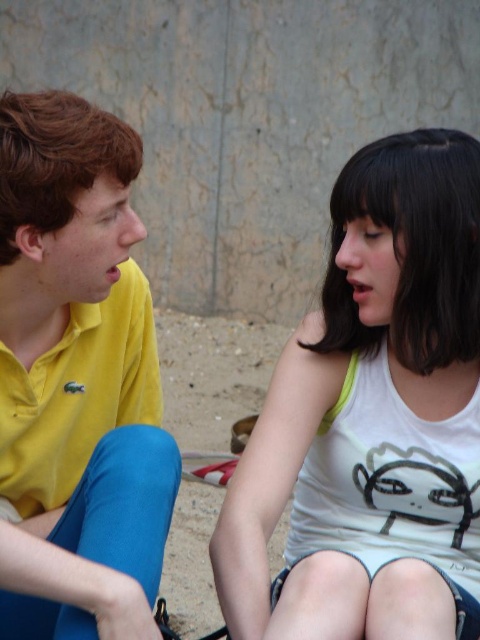
Can you confirm if white cotton tank top at center is wider than yellow matte polo shirt at left?

Yes.

Does point (330, 358) come closer to viewer compared to point (12, 371)?

No, (330, 358) is further to viewer.

Is point (303, 369) less distant than point (55, 262)?

No, it is not.

Image resolution: width=480 pixels, height=640 pixels. Find the location of `white cotton tank top at center`. white cotton tank top at center is located at coordinates (372, 419).